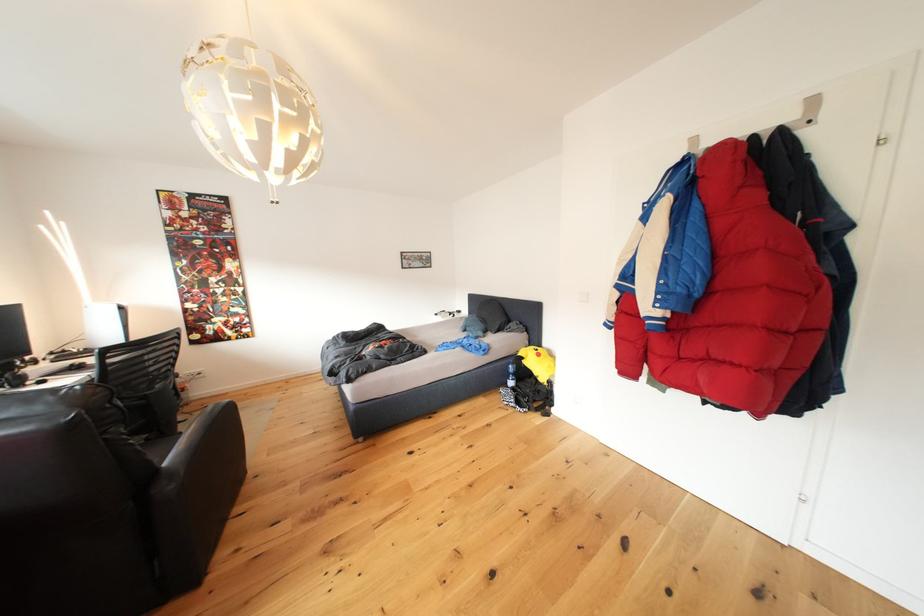
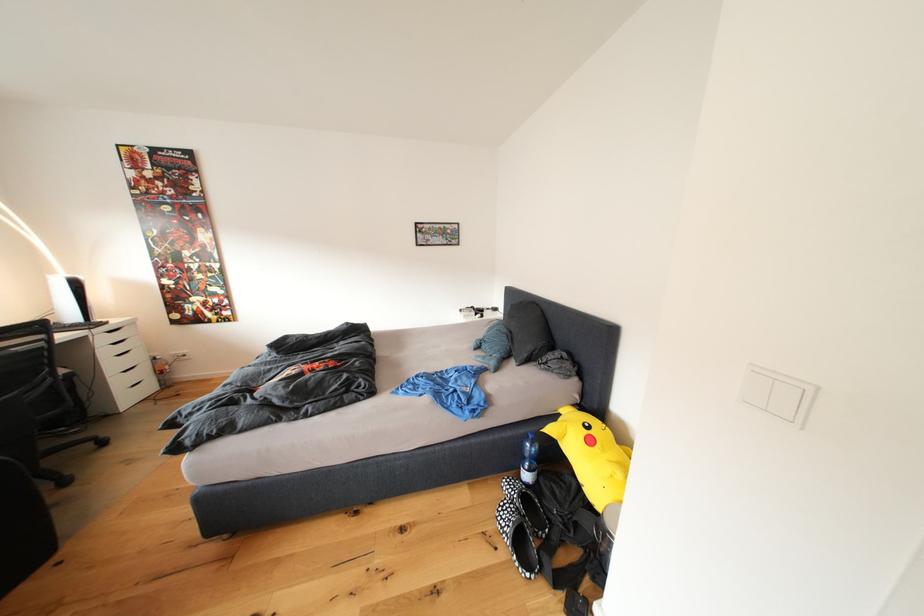
Find the pixel in the second image that matches point (444, 320) in the first image.

(469, 315)